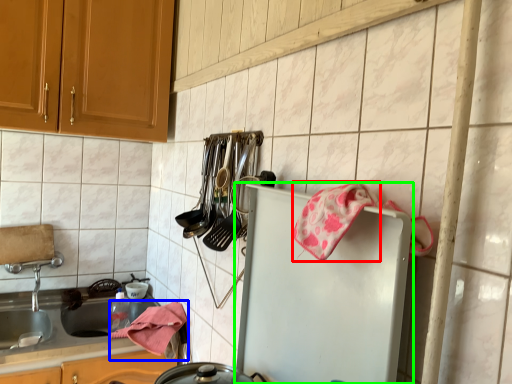
Question: Estimate the real-world distances between objects in this image. Which object is closer to material (highlighted by a red box), material (highlighted by a blue box) or refrigerator (highlighted by a green box)?

Choices:
 (A) material
 (B) refrigerator

Answer: (B)